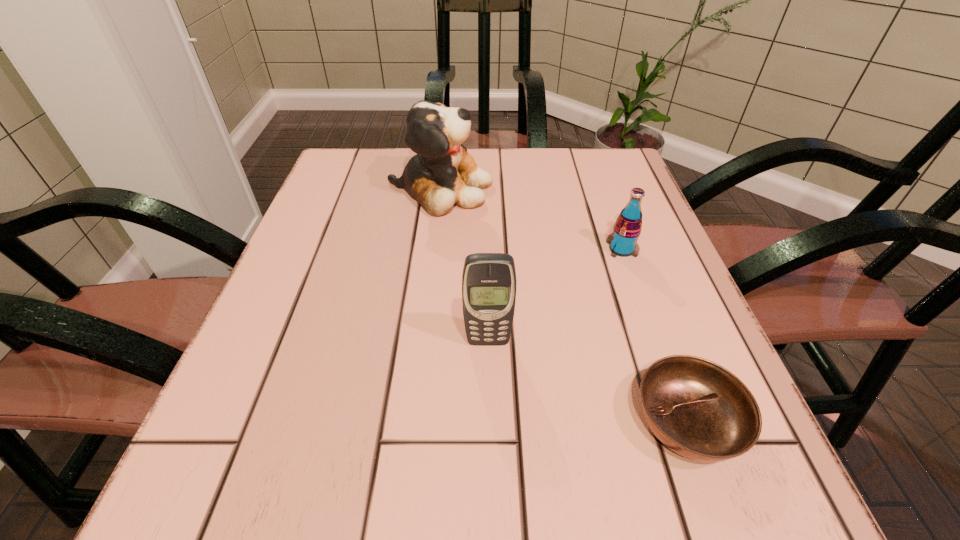
Identify the location of vacant area at the right edge of the desktop. (677, 333).

The image size is (960, 540). Find the location of `vacant area at the far left corner of the desktop`. vacant area at the far left corner of the desktop is located at coordinates (x=337, y=194).

In the image, there is a desktop. Where is `blank space at the near left corner`? The width and height of the screenshot is (960, 540). blank space at the near left corner is located at coordinates (317, 472).

In the image, there is a desktop. What are the coordinates of `vacant area at the far right corner` in the screenshot? It's located at (621, 196).

Locate an element on the screen. vacant point located between the second nearest object and the third nearest object is located at coordinates (555, 295).

The image size is (960, 540). Identify the location of free spot between the cellular telephone and the shortest object. (588, 381).

Image resolution: width=960 pixels, height=540 pixels. Identify the location of vacant space that's between the puppy and the third tallest object. (531, 219).

Locate an element on the screen. The height and width of the screenshot is (540, 960). free point between the farthest object and the third farthest object is located at coordinates (464, 265).

Locate an element on the screen. The image size is (960, 540). vacant space that is in between the third nearest object and the nearest object is located at coordinates (655, 335).

Where is `unoccupied position between the cellular telephone and the shortest object`? The width and height of the screenshot is (960, 540). unoccupied position between the cellular telephone and the shortest object is located at coordinates (588, 381).